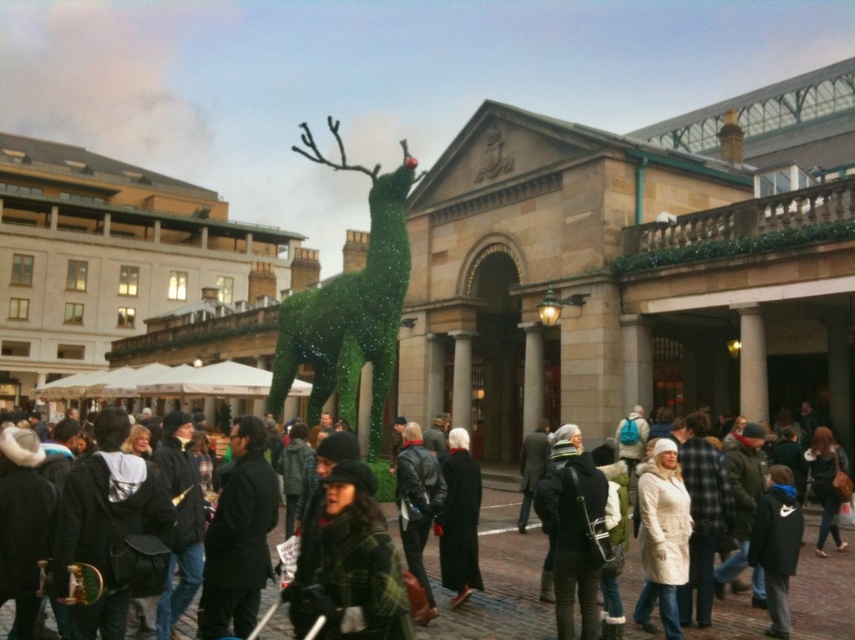
You are a photographer setting up for an event in the square. You need to position two coats, the white matte coat at center and the matte black coat at center, such that they don not block the view of the reindeer sculpture. Given their sizes, which coat should you place closer to the front to ensure both are visible without overlapping?

The white matte coat at center occupies less space than the matte black coat at center. To ensure both coats are visible without overlapping, place the smaller white matte coat at center closer to the front, allowing the larger matte black coat at center to be positioned slightly behind but still visible.

You are a delivery person carrying a package that is 10 feet long. You need to navigate through the space between the white woolen hat at center and the white matte coat at center. Will the package fit through this space?

The distance between the white woolen hat at center and the white matte coat at center is 9.67 feet. Since the package is 10 feet long, it will not fit through the space between them.